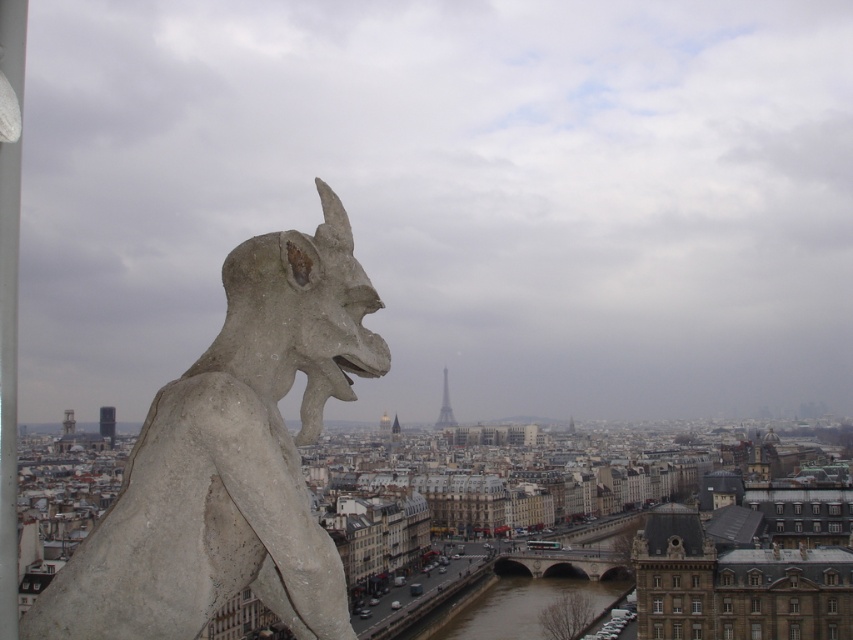
You are a tourist standing at the base of the gray stone gargoyle at upper left and want to take a photo of the metallic silver tower at center. Can you see the tower clearly without any obstruction from the gargoyle?

The gray stone gargoyle at upper left is in front of the metallic silver tower at center, so the gargoyle will block your view of the tower.

You are a tourist standing at the base of the gray stone gargoyle at upper left and want to take a photo of the metallic silver tower at center. Since the gargoyle is between you and the tower, will the tower be fully visible in your photo?

The gray stone gargoyle at upper left is not as tall as the metallic silver tower at center, so the tower will be fully visible in your photo since the gargoyle is shorter and won